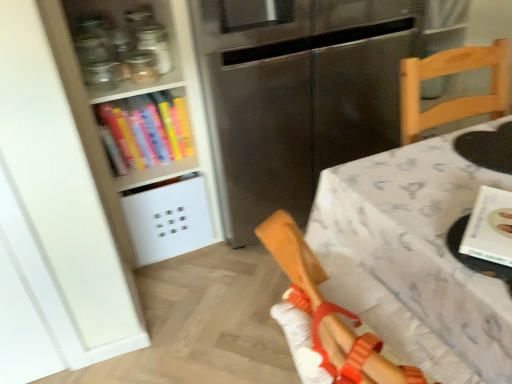
Identify the location of vacant space behind white paper book at right, positioned as the second book in back-to-front order. (446, 182).